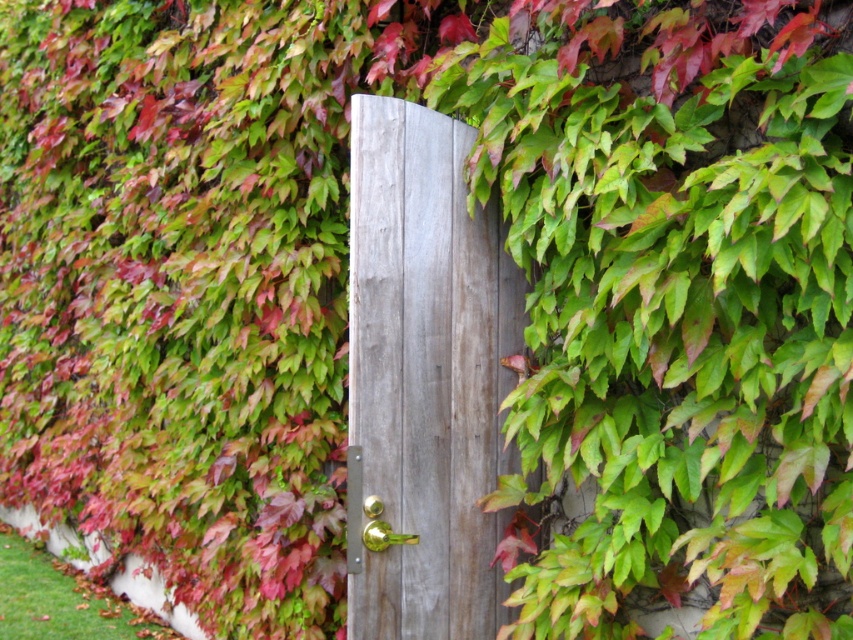
Does gray wood door at center have a larger size compared to gold metallic door handle at center?

Yes, gray wood door at center is bigger than gold metallic door handle at center.

Does gray wood door at center appear under gold metallic door handle at center?

No.

The width and height of the screenshot is (853, 640). What do you see at coordinates (426, 372) in the screenshot?
I see `gray wood door at center` at bounding box center [426, 372].

In order to click on gray wood door at center in this screenshot , I will do `click(426, 372)`.